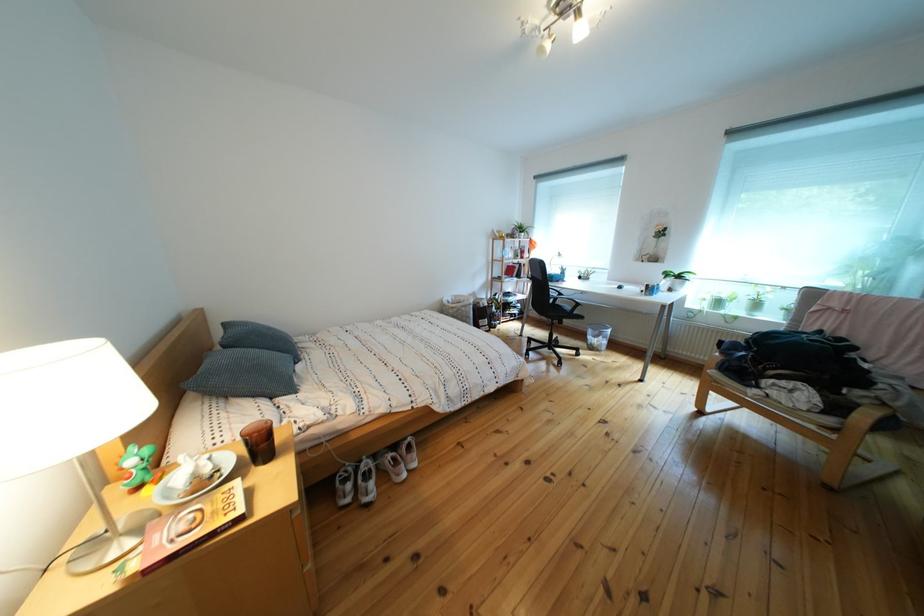
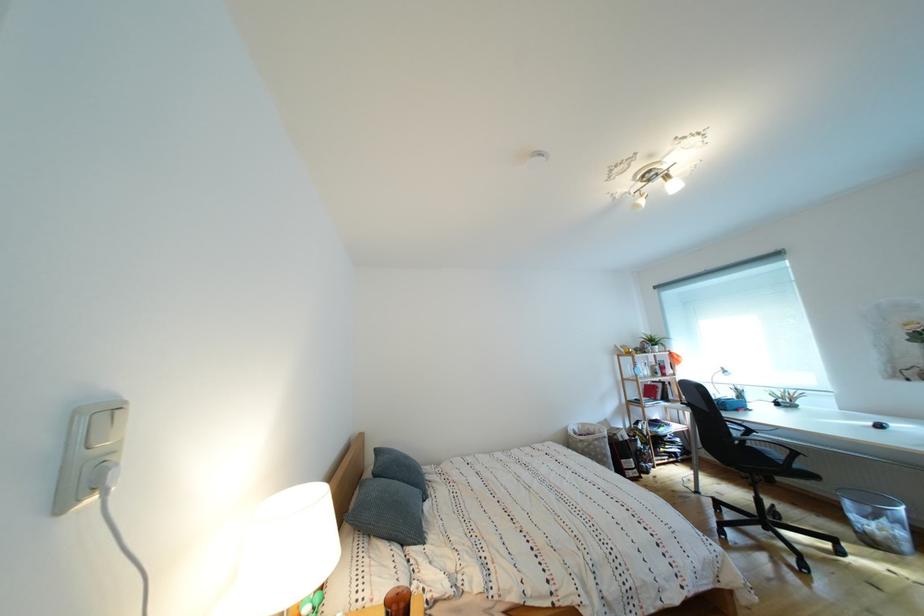
The point at (x=281, y=334) is marked in the first image. Where is the corresponding point in the second image?

(418, 463)